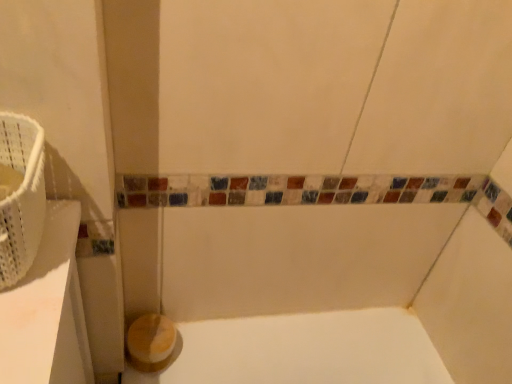
Question: Is wooden toilet paper at lower left taller or shorter than white woven basket at left?

Choices:
 (A) short
 (B) tall

Answer: (A)

Question: Looking at their shapes, would you say wooden toilet paper at lower left is wider or thinner than white woven basket at left?

Choices:
 (A) thin
 (B) wide

Answer: (A)

Question: Is wooden toilet paper at lower left in front of or behind white woven basket at left in the image?

Choices:
 (A) behind
 (B) front

Answer: (A)

Question: Based on their positions, is white woven basket at left located to the left or right of wooden toilet paper at lower left?

Choices:
 (A) right
 (B) left

Answer: (B)

Question: From their relative heights in the image, would you say white woven basket at left is taller or shorter than wooden toilet paper at lower left?

Choices:
 (A) short
 (B) tall

Answer: (B)

Question: Considering the positions of white woven basket at left and wooden toilet paper at lower left in the image, is white woven basket at left wider or thinner than wooden toilet paper at lower left?

Choices:
 (A) wide
 (B) thin

Answer: (A)

Question: Considering their positions, is white woven basket at left located in front of or behind wooden toilet paper at lower left?

Choices:
 (A) front
 (B) behind

Answer: (A)